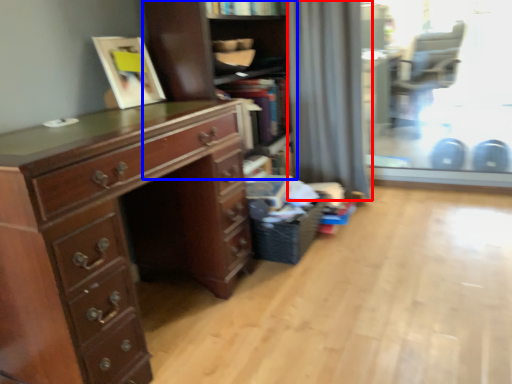
Question: Which point is further to the camera, curtain (highlighted by a red box) or shelf (highlighted by a blue box)?

Choices:
 (A) curtain
 (B) shelf

Answer: (A)